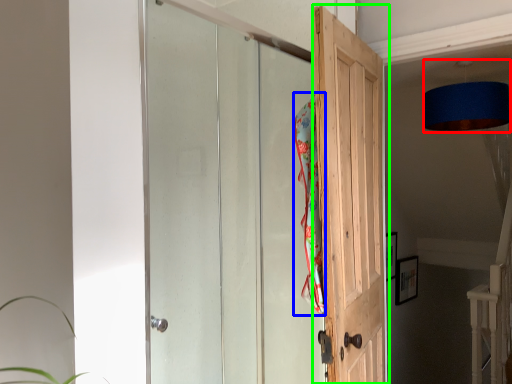
Question: Which object is the closest to the lamp (highlighted by a red box)? Choose among these: beach towel (highlighted by a blue box) or door (highlighted by a green box).

Choices:
 (A) beach towel
 (B) door

Answer: (B)